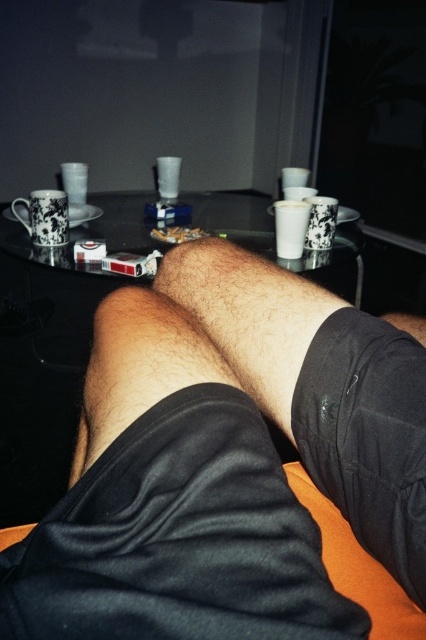
Does black cotton leg at center appear under transparent glass table at center?

Yes.

Where is `black cotton leg at center`? black cotton leg at center is located at coordinates pos(322,388).